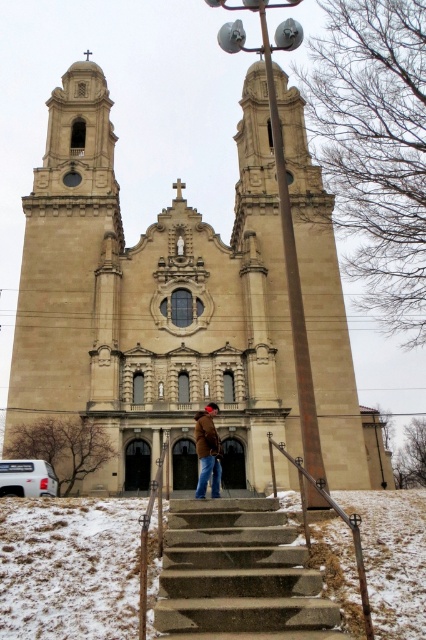
Question: Among these objects, which one is farthest from the camera?

Choices:
 (A) concrete stairs at center
 (B) brown leather coat at center
 (C) metallic silver railing at lower center

Answer: (B)

Question: Can you confirm if beige stone church at center is positioned below brown leather coat at center?

Choices:
 (A) yes
 (B) no

Answer: (B)

Question: Where is beige stone church at center located in relation to concrete stairs at center in the image?

Choices:
 (A) left
 (B) right

Answer: (A)

Question: Which object is positioned closest to the concrete stairs at center?

Choices:
 (A) beige stone church at center
 (B) metallic silver railing at lower center
 (C) brown leather coat at center

Answer: (B)

Question: Which point is closer to the camera taking this photo?

Choices:
 (A) (259, 593)
 (B) (235, 218)
 (C) (307, 540)
 (D) (207, 428)

Answer: (A)

Question: Does beige stone church at center appear on the right side of brown leather coat at center?

Choices:
 (A) yes
 (B) no

Answer: (B)